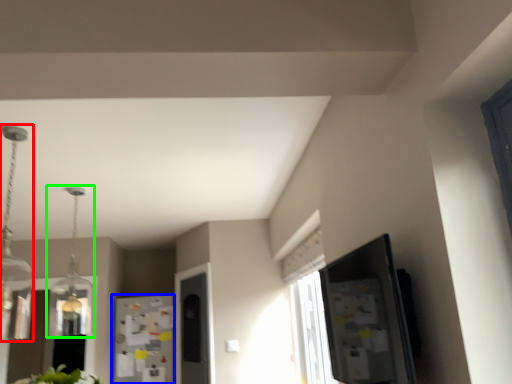
Question: Which object is the closest to the light fixture (highlighted by a red box)? Choose among these: fridge (highlighted by a blue box) or light fixture (highlighted by a green box).

Choices:
 (A) fridge
 (B) light fixture

Answer: (B)